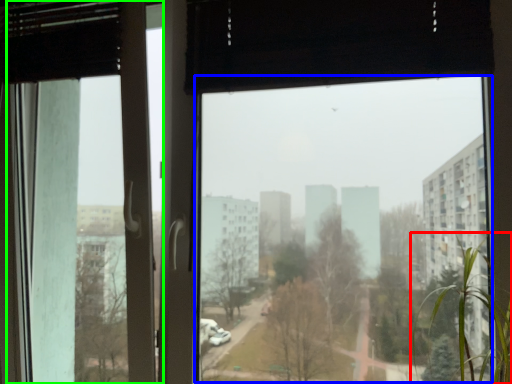
Question: Which object is positioned farthest from tree (highlighted by a red box)? Select from window screen (highlighted by a blue box) and screen door (highlighted by a green box).

Choices:
 (A) window screen
 (B) screen door

Answer: (A)